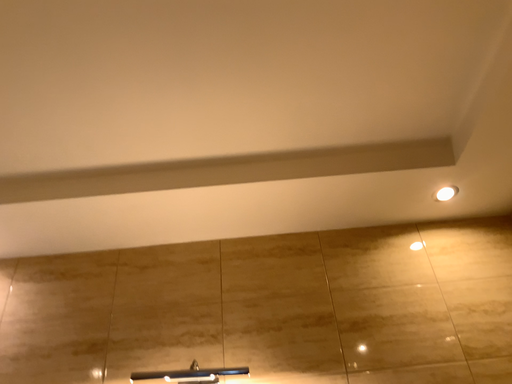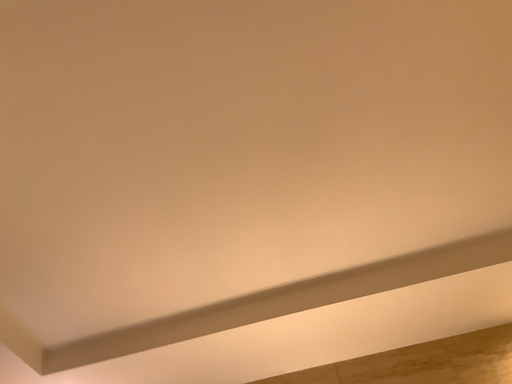
Question: Which way did the camera rotate in the video?

Choices:
 (A) rotated downward
 (B) rotated upward

Answer: (B)